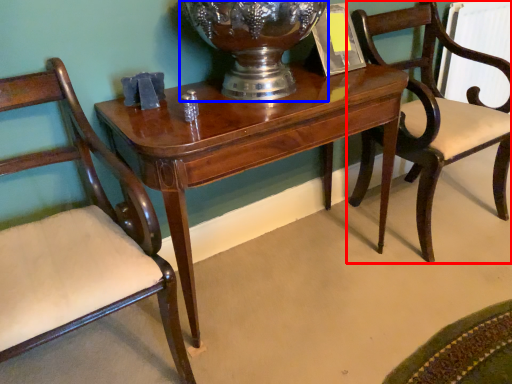
Question: Which point is closer to the camera, chair (highlighted by a red box) or glass vase (highlighted by a blue box)?

Choices:
 (A) chair
 (B) glass vase

Answer: (B)